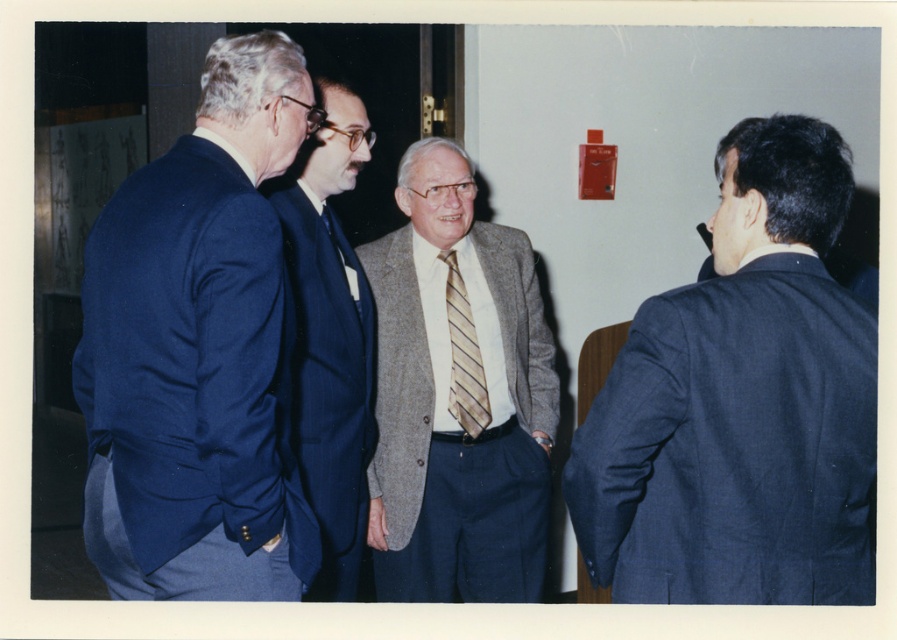
Question: Observing the image, what is the correct spatial positioning of dark blue suit at right in reference to blue wool suit at center?

Choices:
 (A) below
 (B) above

Answer: (A)

Question: Does dark blue suit at right appear on the left side of striped silk tie at center?

Choices:
 (A) no
 (B) yes

Answer: (A)

Question: Which of these objects is positioned farthest from the gray textured blazer at center?

Choices:
 (A) dark blue suit at right
 (B) striped fabric tie at center

Answer: (A)

Question: Which point appears closest to the camera in this image?

Choices:
 (A) (464, 388)
 (B) (632, 536)
 (C) (351, 288)

Answer: (B)

Question: Which of the following is the closest to the observer?

Choices:
 (A) striped fabric tie at center
 (B) gray textured blazer at center

Answer: (A)

Question: Is blue wool suit at center behind striped fabric tie at center?

Choices:
 (A) yes
 (B) no

Answer: (B)